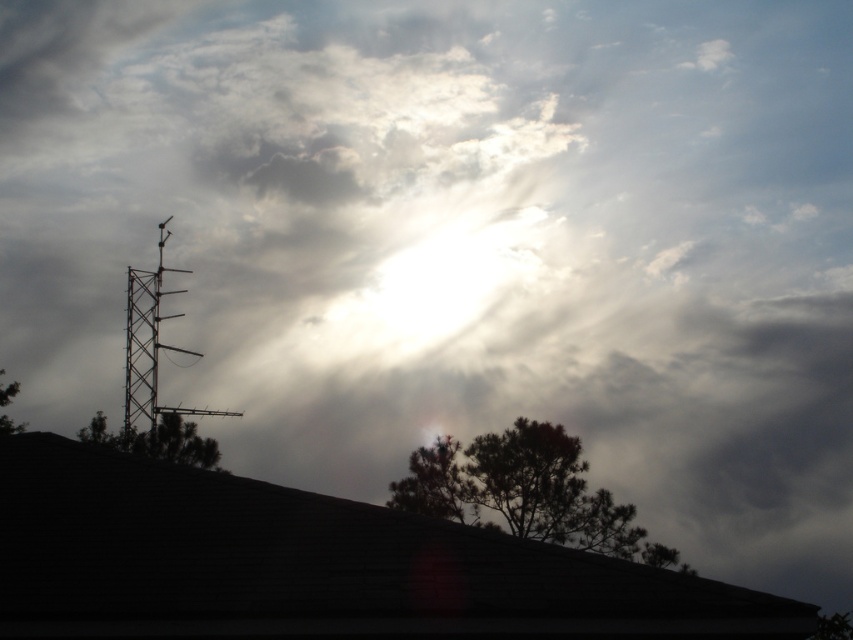
Question: Which point is farther from the camera taking this photo?

Choices:
 (A) (1, 396)
 (B) (451, 499)
 (C) (160, 442)

Answer: (B)

Question: Is green leafy tree at center bigger than green matte tree at center?

Choices:
 (A) yes
 (B) no

Answer: (B)

Question: Among these points, which one is nearest to the camera?

Choices:
 (A) [x=93, y=440]
 (B) [x=415, y=509]
 (C) [x=0, y=385]
 (D) [x=456, y=468]

Answer: (A)

Question: Does dark green textured tree at upper center appear on the left side of green leafy tree at left?

Choices:
 (A) no
 (B) yes

Answer: (A)

Question: Which of the following is the closest to the observer?

Choices:
 (A) (576, 541)
 (B) (18, 385)
 (C) (430, 490)
 (D) (196, 449)

Answer: (D)

Question: Considering the relative positions of green leafy tree at center and green leafy tree at left in the image provided, where is green leafy tree at center located with respect to green leafy tree at left?

Choices:
 (A) left
 (B) right

Answer: (B)